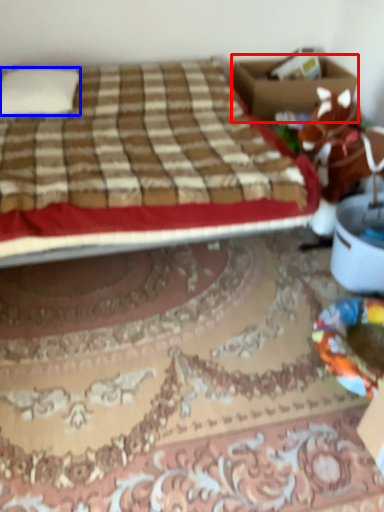
Question: Which point is closer to the camera, box (highlighted by a red box) or pillow (highlighted by a blue box)?

Choices:
 (A) box
 (B) pillow

Answer: (B)